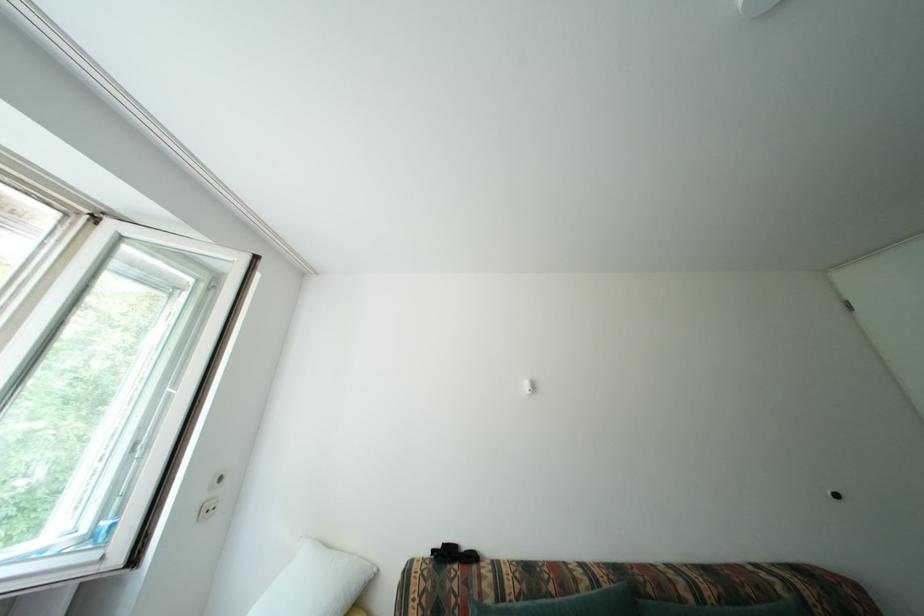
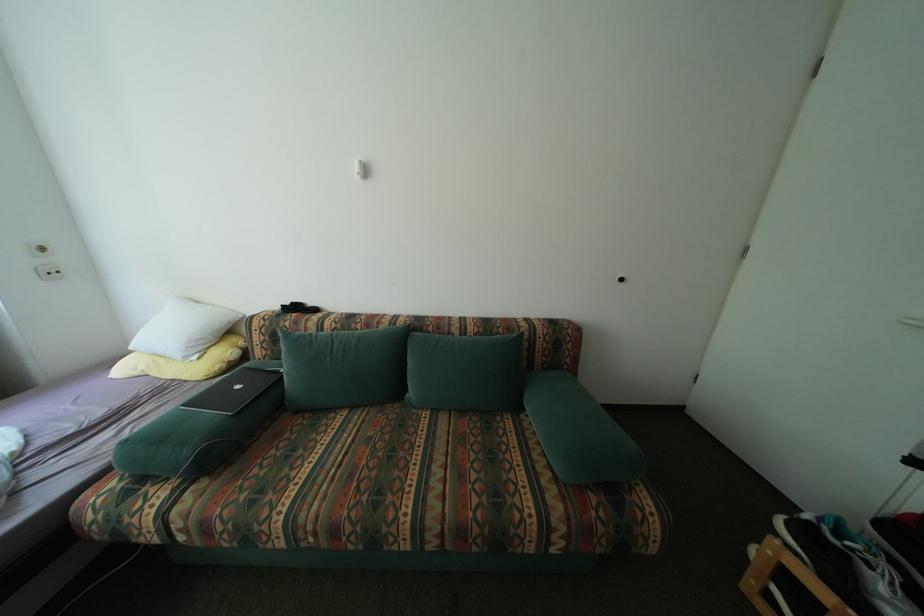
Question: The first image is from the beginning of the video and the second image is from the end. How did the camera likely rotate when shooting the video?

Choices:
 (A) Left
 (B) Right
 (C) Up
 (D) Down

Answer: (D)